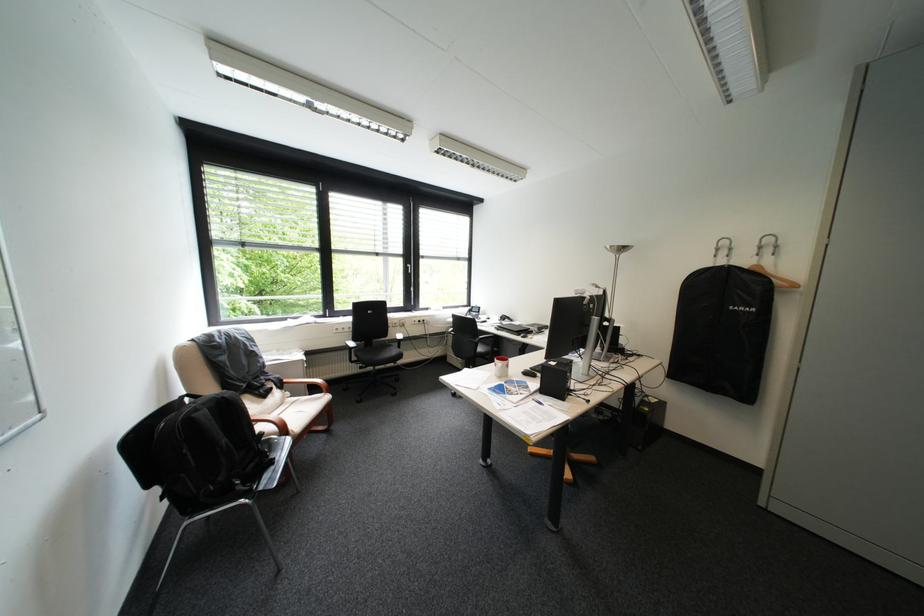
Find the location of a particular element. This screenshot has height=616, width=924. black chair sitting surface is located at coordinates (385, 354).